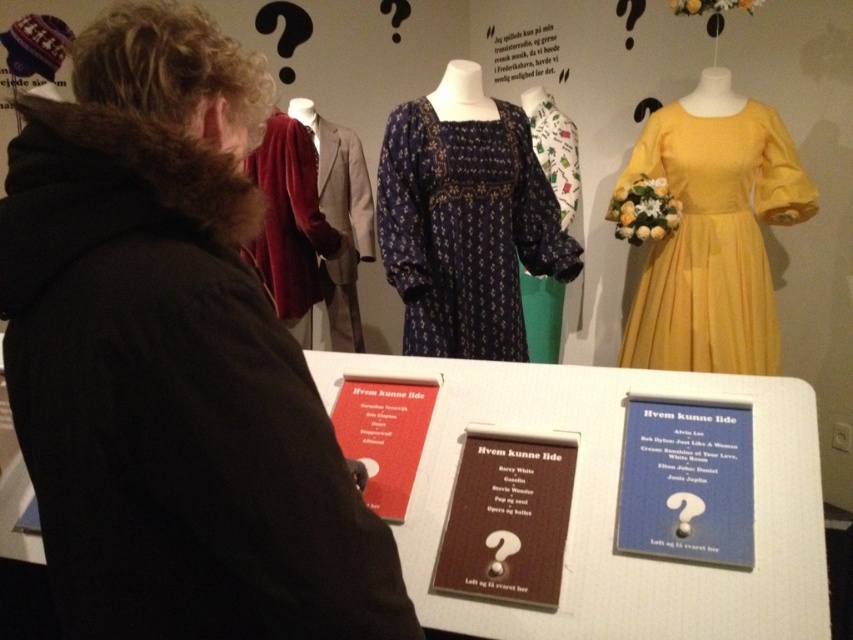
You are a visitor standing at the entrance of the museum exhibit. You want to take a photo of the yellow satin dress at upper right without moving closer than 2 meters from it. Is the current distance sufficient for a clear photo?

The yellow satin dress at upper right and the viewer are 2.20 meters apart, which is more than the required 2 meters, so the distance is sufficient for a clear photo.

You are a museum visitor who wants to know if the matte brown card at center can be placed on top of the velvet red robe at left without bending it. Can it fit?

The matte brown card at center is thinner than the velvet red robe at left, so yes, it can be placed on top without bending.

You are a visitor at the museum and want to take a photo of the yellow satin dress at upper right and the blue paper at center. Which object should you focus on first if you want to capture both in the same frame without moving the camera?

The yellow satin dress at upper right is much taller than the blue paper at center, so you should focus on the yellow satin dress at upper right first to ensure it fits within the frame.